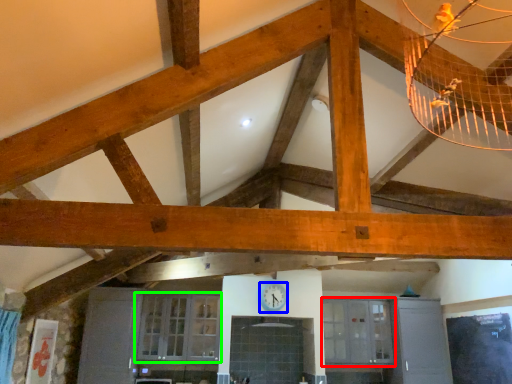
Question: Considering the real-world distances, which object is closest to window (highlighted by a red box)? clock (highlighted by a blue box) or window (highlighted by a green box).

Choices:
 (A) clock
 (B) window

Answer: (A)